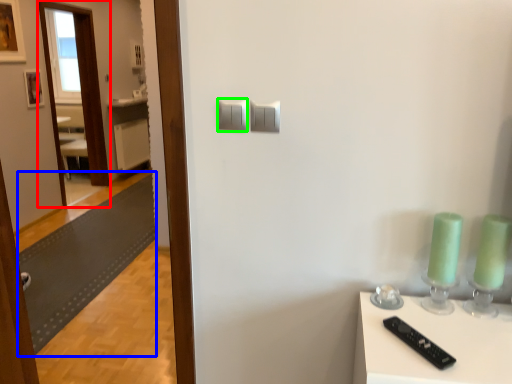
Question: Which is nearer to the glass door (highlighted by a red box)? mat (highlighted by a blue box) or light switch (highlighted by a green box).

Choices:
 (A) mat
 (B) light switch

Answer: (A)